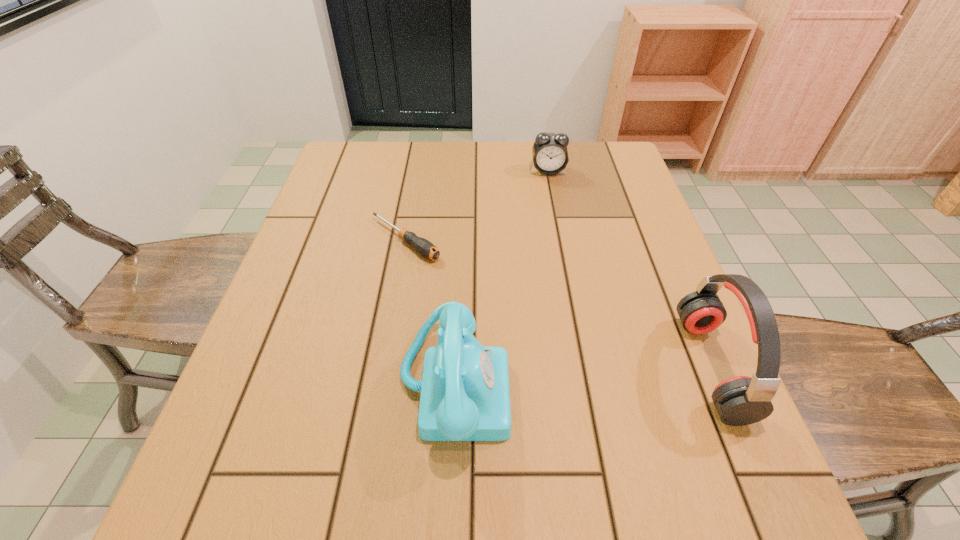
You are a GUI agent. You are given a task and a screenshot of the screen. Output one action in this format:
    pyautogui.click(x=<x>, y=<y>)
    Task: Click on the vacant space that's between the third nearest object and the rightmost object
    This screenshot has height=540, width=960.
    Given the screenshot: What is the action you would take?
    pyautogui.click(x=558, y=303)

You are a GUI agent. You are given a task and a screenshot of the screen. Output one action in this format:
    pyautogui.click(x=<x>, y=<y>)
    Task: Click on the unoccupied position between the screwdriver and the telephone
    Image resolution: width=960 pixels, height=540 pixels.
    Given the screenshot: What is the action you would take?
    pyautogui.click(x=430, y=312)

Where is `vacant region between the telephone and the alarm clock`? vacant region between the telephone and the alarm clock is located at coordinates (501, 278).

Where is `vacant area that lies between the rightmost object and the shortest object`? Image resolution: width=960 pixels, height=540 pixels. vacant area that lies between the rightmost object and the shortest object is located at coordinates (558, 303).

Where is `vacant region between the farthest object and the telephone`? The width and height of the screenshot is (960, 540). vacant region between the farthest object and the telephone is located at coordinates (501, 278).

Where is `free space between the telephone and the tallest object`? Image resolution: width=960 pixels, height=540 pixels. free space between the telephone and the tallest object is located at coordinates (583, 376).

Locate an element on the screen. The image size is (960, 540). free space between the tallest object and the shortest object is located at coordinates [558, 303].

This screenshot has height=540, width=960. I want to click on vacant space that's between the farthest object and the rightmost object, so click(630, 269).

I want to click on the closest object to the rightmost object, so click(465, 396).

Locate an element on the screen. The width and height of the screenshot is (960, 540). object that is the closest to the second object from right to left is located at coordinates (424, 247).